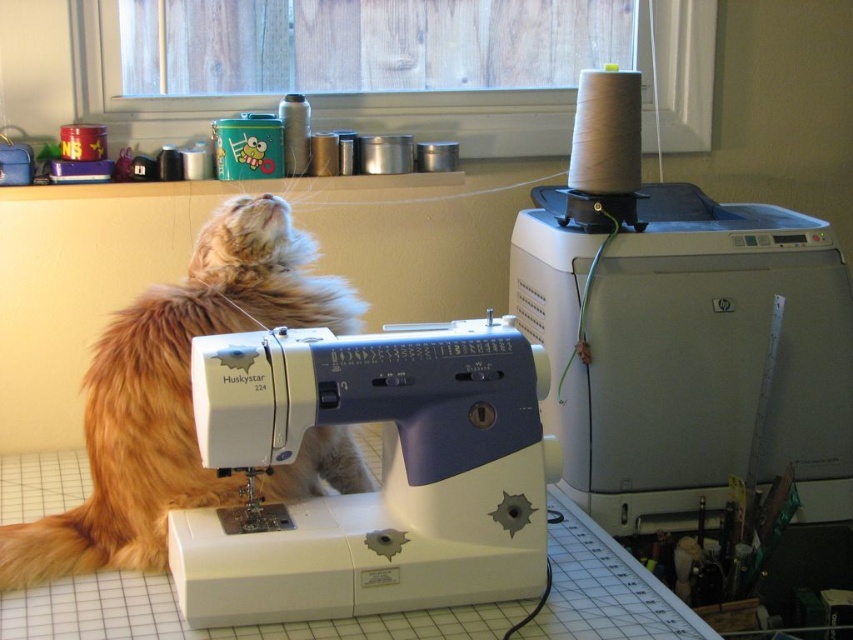
What is the 2D coordinate of the white plastic sewing machine at center?

The white plastic sewing machine at center is located at the 2D coordinate point of (383, 474).

You are setting up a workspace and need to know which object is taller between the matte gray printer at upper right and the white plastic sewing machine at center. Can you tell me which one is taller?

The matte gray printer at upper right is taller than the white plastic sewing machine at center according to the description.

You are organizing a workspace and need to move the fuzzy orange cat at upper left and the matte gray printer at upper right. Based on their current positions, which object is closer to the left edge of the tiled surface?

The fuzzy orange cat at upper left is closer to the left edge of the tiled surface because the matte gray printer at upper right is positioned on the right side of it.